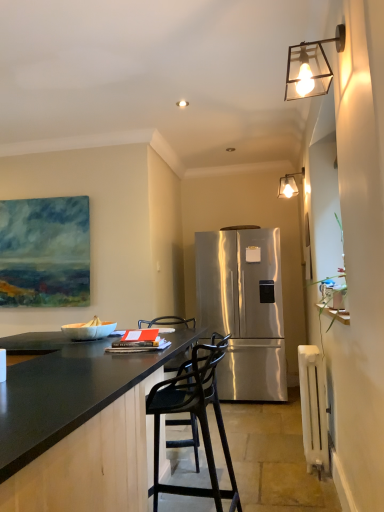
Question: Does point pos(208,493) appear closer or farther from the camera than point pos(327,446)?

Choices:
 (A) farther
 (B) closer

Answer: (B)

Question: Considering the positions of black matte bar stool at center and white painted radiator at lower right in the image, is black matte bar stool at center wider or thinner than white painted radiator at lower right?

Choices:
 (A) wide
 (B) thin

Answer: (A)

Question: Estimate the real-world distances between objects in this image. Which object is closer to the metallic glass lampshade at upper right, which ranks as the 2th lamp in left-to-right order?

Choices:
 (A) white glossy bowl at lower left
 (B) black granite countertop at center
 (C) metallic glass wall sconce at upper right, which appears as the second lamp when viewed from the right
 (D) black matte bar stool at center
 (E) white painted radiator at lower right

Answer: (E)

Question: Considering the real-world distances, which object is farthest from the metallic glass wall sconce at upper right, arranged as the 1th lamp when viewed from the front?

Choices:
 (A) stainless steel refrigerator at center
 (B) white painted radiator at lower right
 (C) black granite countertop at center
 (D) metallic glass lampshade at upper right, the 1th lamp from the back
 (E) black matte bar stool at center

Answer: (A)